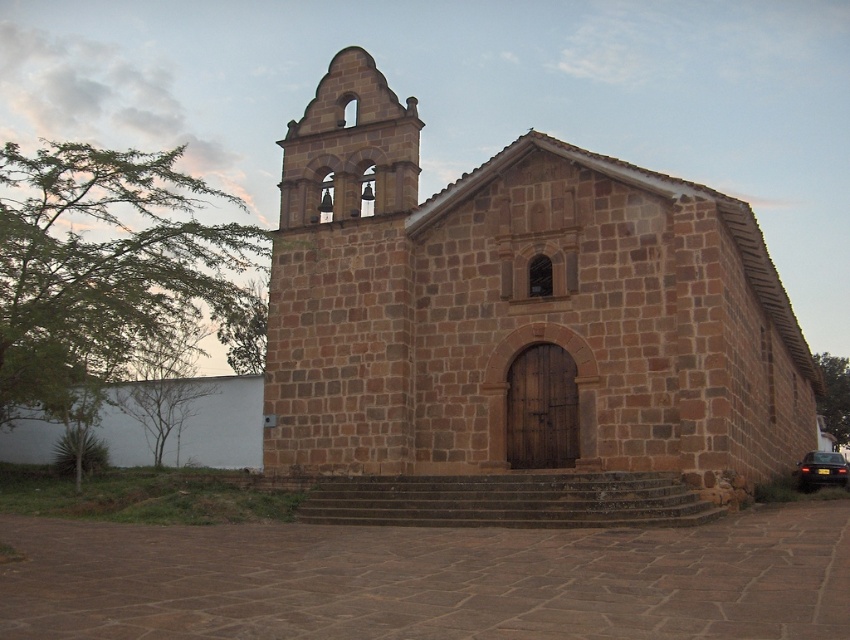
You are standing at the base of the stone steps leading to the church entrance. You want to take a photo of the brown stone church at center from a position that ensures the entire structure is visible in the frame. Given that your camera has a standard field of view, where should you position yourself relative to the point indicated by point (516, 332)?

The point (516, 332) indicates the brown stone church at center, so to capture the entire structure in the frame, you should position yourself directly in front of this point to ensure the church is centered and fully visible.

You are a visitor approaching the brown stone church at center and the brown stone bell tower at upper left. Which structure would appear larger in your view?

The brown stone church at center is much taller than the brown stone bell tower at upper left, so it would appear larger in your view.